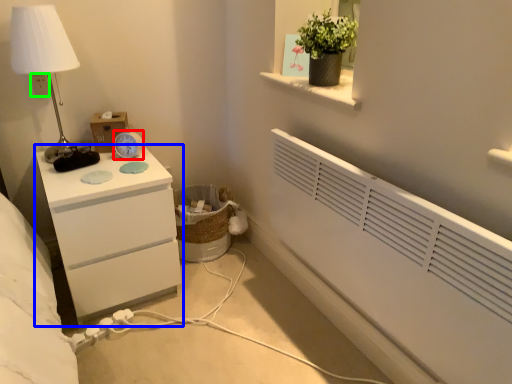
Question: Considering the real-world distances, which object is farthest from alarm clock (highlighted by a red box)? chest of drawers (highlighted by a blue box) or electric outlet (highlighted by a green box)?

Choices:
 (A) chest of drawers
 (B) electric outlet

Answer: (B)